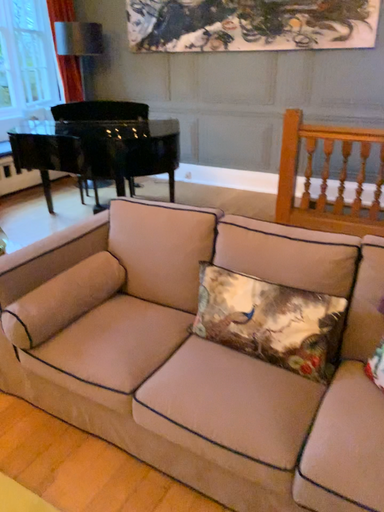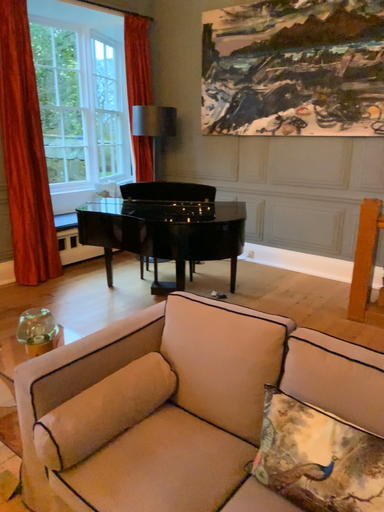
Question: How did the camera likely rotate when shooting the video?

Choices:
 (A) rotated downward
 (B) rotated upward

Answer: (B)